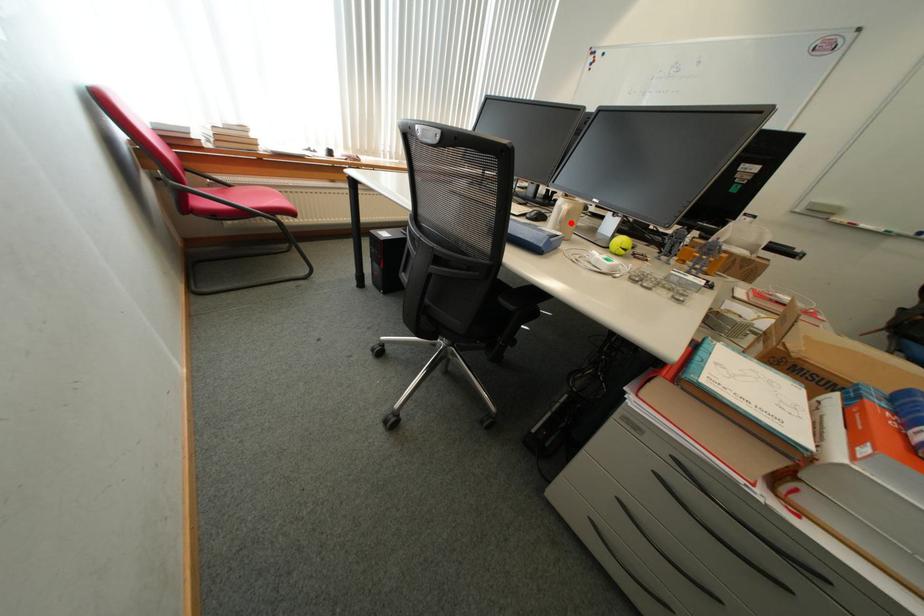
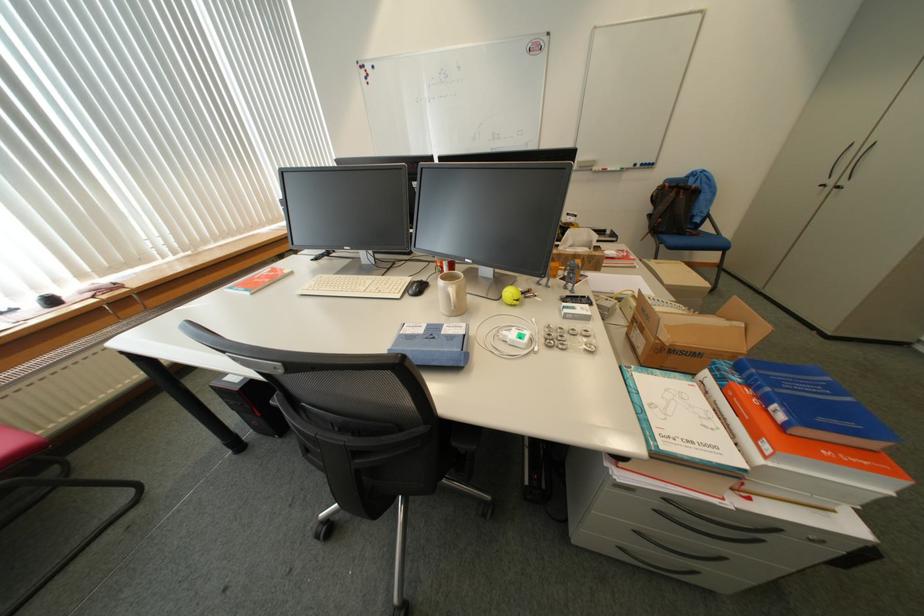
Locate, in the second image, the point that corresponds to the highlighted location in the first image.

(465, 309)